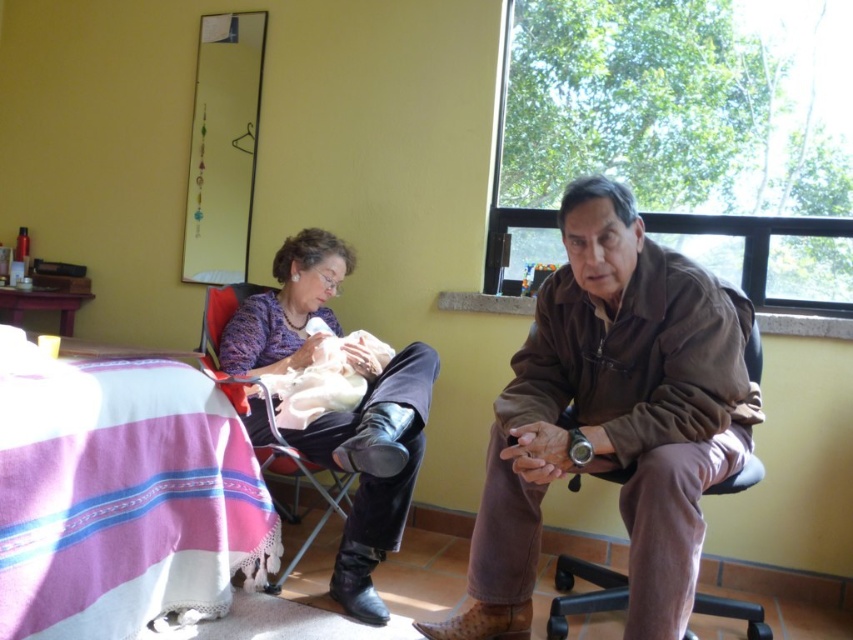
Which is more to the left, velvet-like red armchair at left or soft white baby at center?

Positioned to the left is velvet-like red armchair at left.

Does velvet-like red armchair at left appear over soft white baby at center?

Actually, velvet-like red armchair at left is below soft white baby at center.

Describe the element at coordinates (299, 484) in the screenshot. The image size is (853, 640). I see `velvet-like red armchair at left` at that location.

Identify the location of velvet-like red armchair at left. (299, 484).

Measure the distance between matte black boots at lower left and velvet-like red armchair at left.

A distance of 8.70 inches exists between matte black boots at lower left and velvet-like red armchair at left.

Is matte black boots at lower left further to camera compared to velvet-like red armchair at left?

No, it is not.

Where is `matte black boots at lower left`? Image resolution: width=853 pixels, height=640 pixels. matte black boots at lower left is located at coordinates (373, 465).

In order to click on matte black boots at lower left in this screenshot , I will do `click(373, 465)`.

Between point (589, 349) and point (215, 368), which one is positioned behind?

The point (215, 368) is behind.

This screenshot has width=853, height=640. I want to click on brown suede jacket at center, so click(x=613, y=417).

Does point (495, 460) come behind point (202, 353)?

No.

Where is `brown suede jacket at center`? brown suede jacket at center is located at coordinates (613, 417).